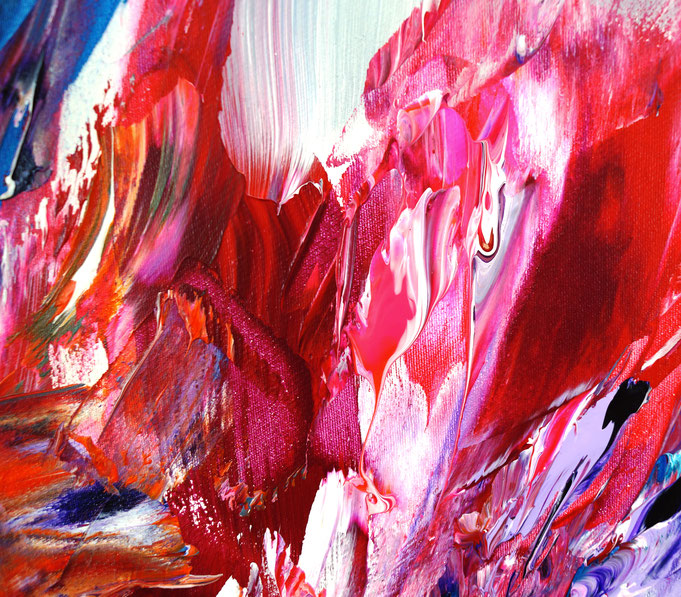
You are a GUI agent. You are given a task and a screenshot of the screen. Output one action in this format:
    pyautogui.click(x=<x>, y=<y>)
    Task: Click on the paint canvas
    Image resolution: width=681 pixels, height=597 pixels.
    Given the screenshot: What is the action you would take?
    pyautogui.click(x=329, y=122)